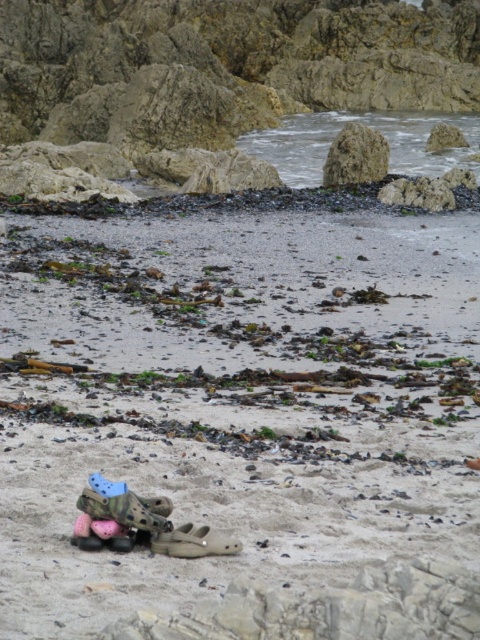
You are standing on the beach and want to place a 20 meter long boat behind the brown rough rock at upper center. Is there enough space behind the rock to fit the boat?

The brown rough rock at upper center is 19.04 meters away from the viewer, so placing a 20 meter long boat behind it would not be possible as the distance is shorter than the boat length.

You are standing on the beach and see the point labeled as point (356, 156). What object is located at that point?

The point (356, 156) indicates a brown rough rock at upper center.